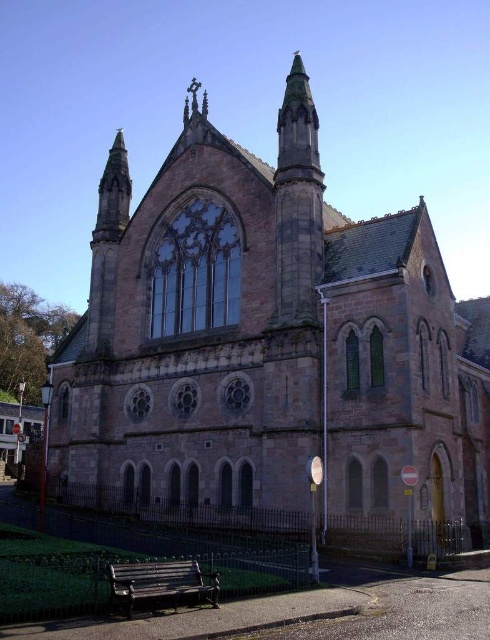
You are standing in front of the grand historic building and want to take a photo of the green stone spire at upper center and the metallic green bench at lower center. Which object should you focus on first to ensure it appears larger in the photo?

The green stone spire at upper center is closer to the viewer than the metallic green bench at lower center, so focusing on it first will make it appear larger in the photo.

You are planning to install a new lighting system for the historic building. The green stone spire at upper center needs to be illuminated, and you have a spotlight with a maximum range of 100 feet. Can the spotlight reach the spire from the metallic green bench at lower center?

The green stone spire at upper center and metallic green bench at lower center are 128.81 feet apart, which exceeds the spotlight maximum range of 100 feet. Therefore, the spotlight cannot reach the spire from the bench.

You are standing in front of the historic building and want to take a photo that includes both the green stone spire at upper center and the metallic green bench at lower center. Which object should you position closer to the top of your camera frame?

The green stone spire at upper center should be positioned closer to the top of your camera frame since it is located above the metallic green bench at lower center.